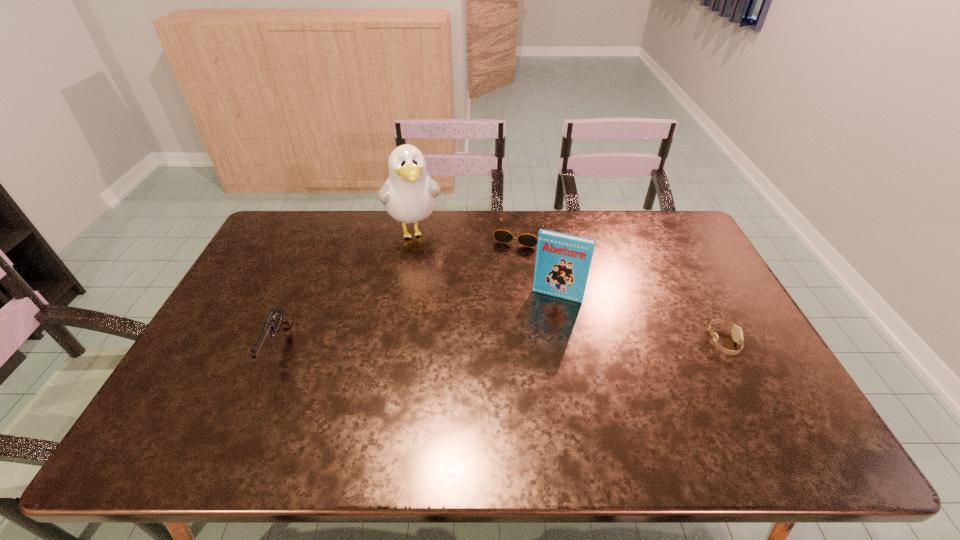
Image resolution: width=960 pixels, height=540 pixels. What are the coordinates of `gun` in the screenshot? It's located at (276, 318).

Identify the location of the leftmost object. This screenshot has width=960, height=540. (276, 318).

You are a GUI agent. You are given a task and a screenshot of the screen. Output one action in this format:
    pyautogui.click(x=<x>, y=<y>)
    Task: Click on the watch
    This screenshot has height=540, width=960.
    Given the screenshot: What is the action you would take?
    pyautogui.click(x=737, y=334)

Find the location of a particular element. sunglasses is located at coordinates click(x=503, y=236).

This screenshot has width=960, height=540. I want to click on the fourth object from right to left, so click(x=409, y=195).

The height and width of the screenshot is (540, 960). I want to click on the tallest object, so click(x=409, y=195).

Locate an element on the screen. The image size is (960, 540). the second tallest object is located at coordinates (562, 265).

What are the coordinates of `the third nearest object` in the screenshot? It's located at (562, 265).

What are the coordinates of `free space located at the end of the barrel of the leftmost object` in the screenshot? It's located at (257, 395).

Find the location of `vacant space located 0.050m on the face of the rightmost object`. vacant space located 0.050m on the face of the rightmost object is located at coordinates (756, 342).